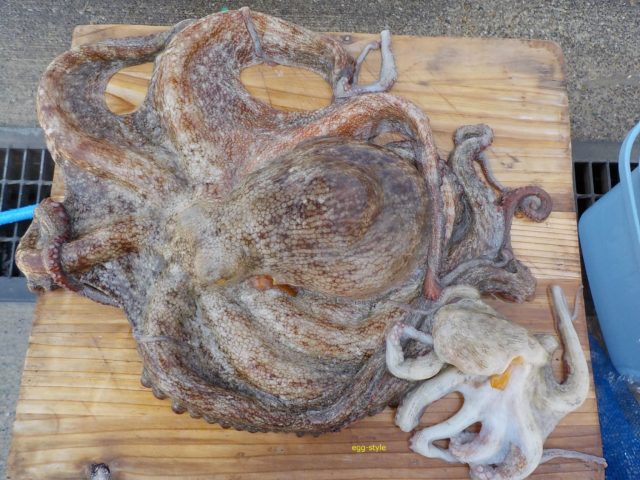
In order to click on blue paint in this screenshot , I will do `click(616, 418)`.